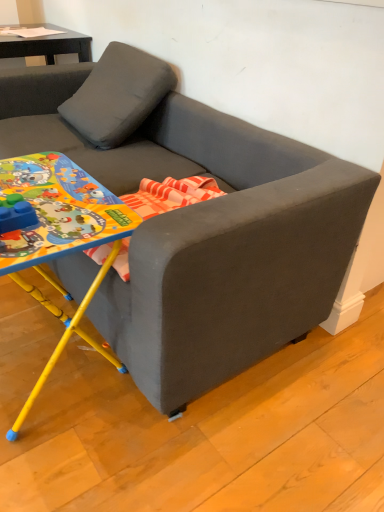
The width and height of the screenshot is (384, 512). Identify the location of empty space that is ontop of yellow plastic table at lower left (from a real-world perspective). (41, 190).